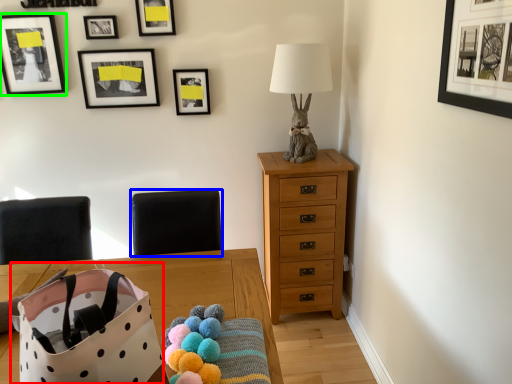
Question: Which object is positioned closest to gift bag (highlighted by a red box)? Select from armchair (highlighted by a blue box) and picture frame (highlighted by a green box).

Choices:
 (A) armchair
 (B) picture frame

Answer: (A)